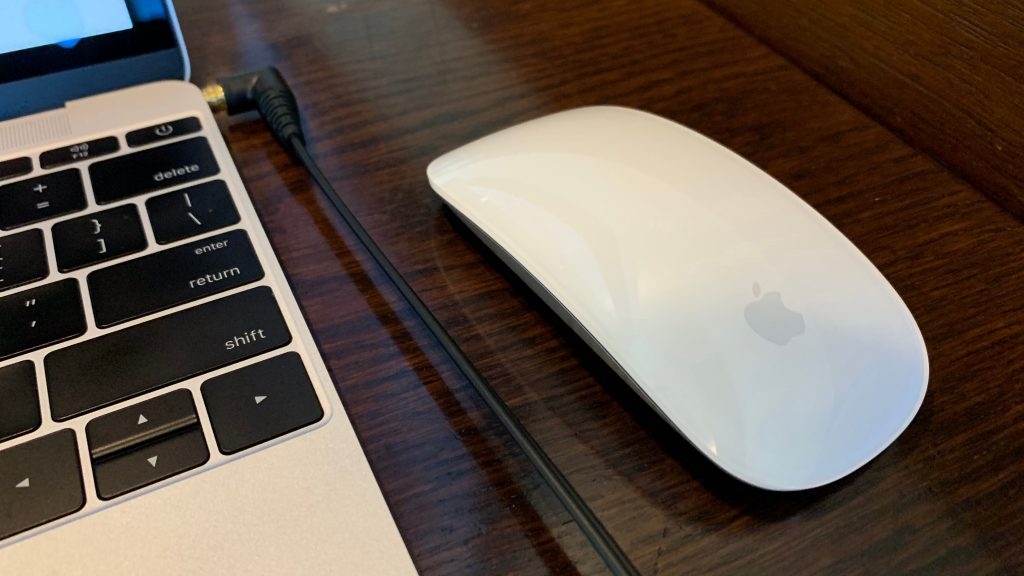
Where is `screen`? This screenshot has width=1024, height=576. screen is located at coordinates (47, 22).